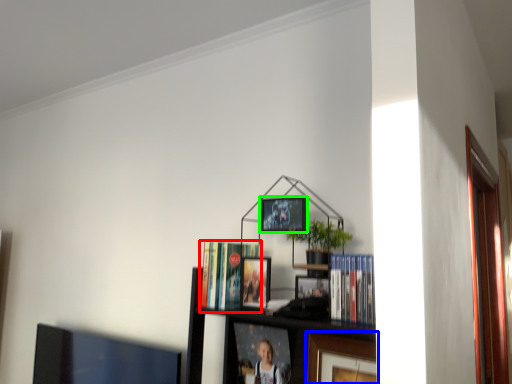
Question: Which object is positioned farthest from book (highlighted by a red box)? Select from picture frame (highlighted by a blue box) and picture frame (highlighted by a green box).

Choices:
 (A) picture frame
 (B) picture frame

Answer: (A)